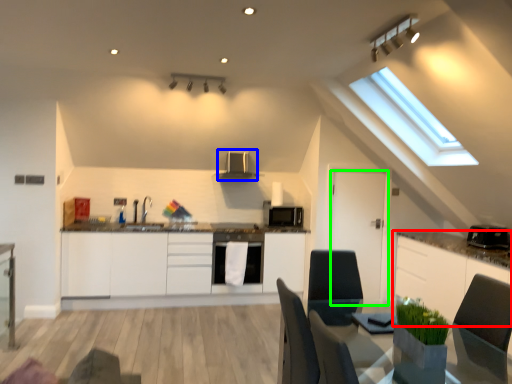
Question: Which object is positioned closest to cabinetry (highlighted by a red box)? Select from exhaust hood (highlighted by a blue box) and door (highlighted by a green box).

Choices:
 (A) exhaust hood
 (B) door

Answer: (B)